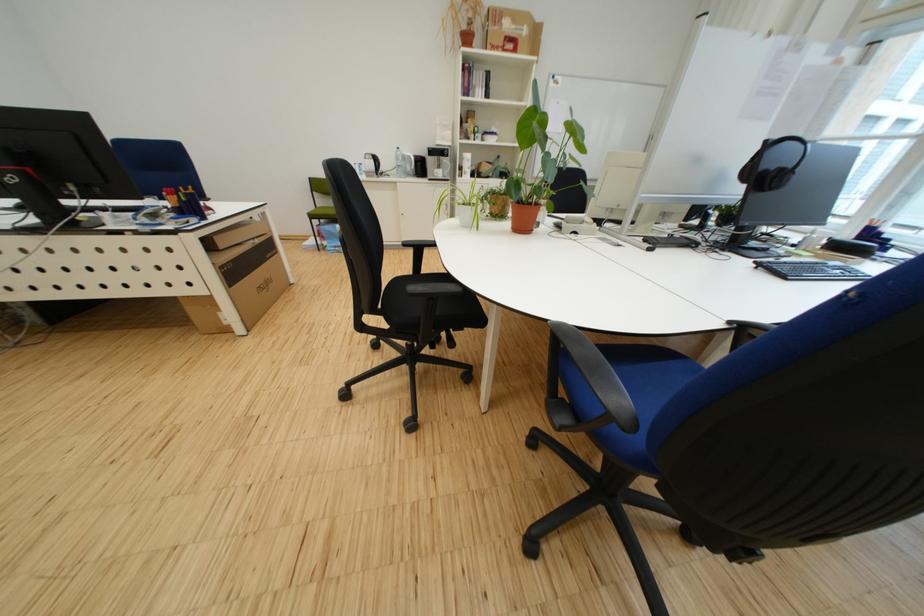
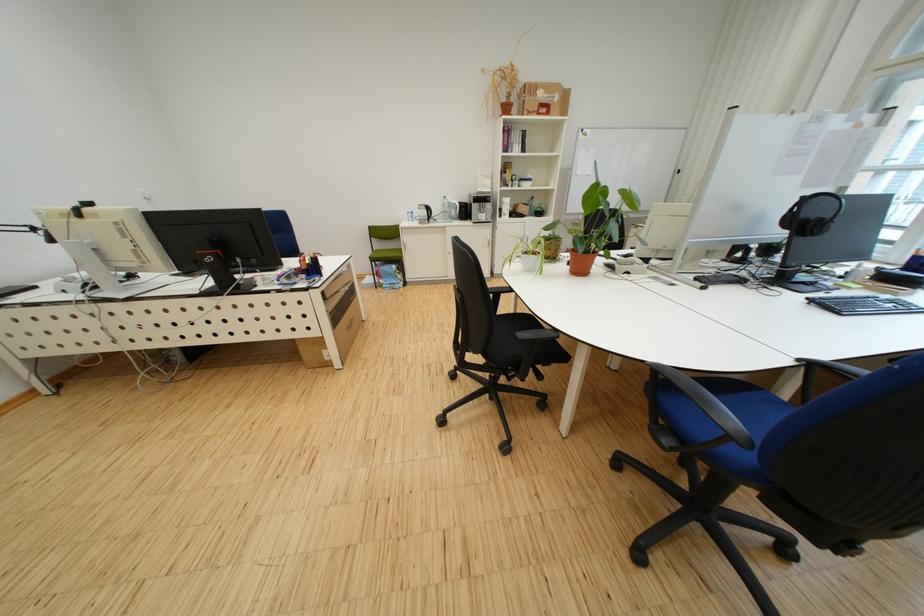
Question: I am providing you with two images of the same scene from different viewpoints. Which of the following objects are not visible in image2?

Choices:
 (A) white electric kettle
 (B) small metal hook
 (C) blue pen holder
 (D) white mug

Answer: (C)